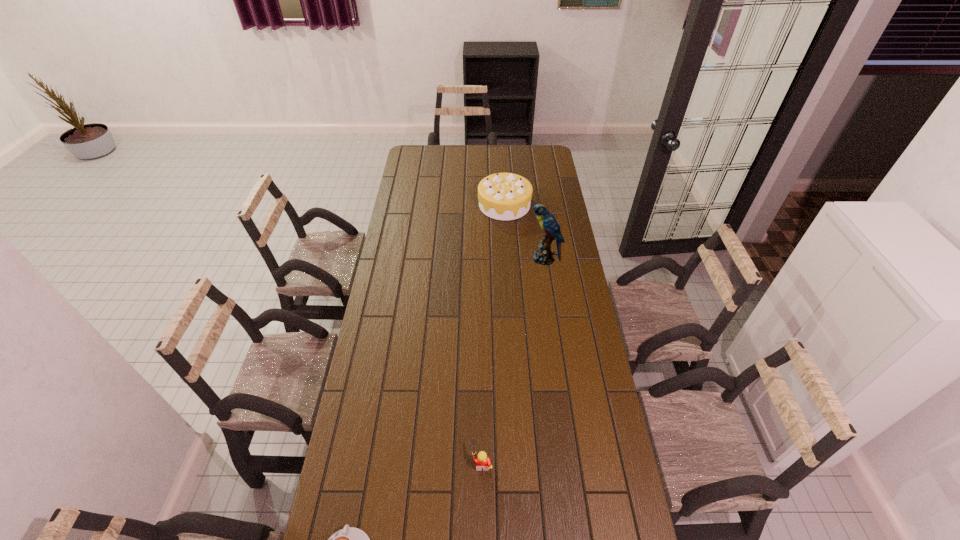
Find the location of a particular element. This screenshot has height=540, width=960. unoccupied area between the Lego and the parrot is located at coordinates (513, 360).

Locate an element on the screen. The width and height of the screenshot is (960, 540). blank region between the parrot and the farthest object is located at coordinates (524, 232).

Locate which object ranks in proximity to the parrot. Please provide its 2D coordinates. Your answer should be formatted as a tuple, i.e. [(x, y)], where the tuple contains the x and y coordinates of a point satisfying the conditions above.

[(502, 196)]

Where is `object that is the second closest one to the tallest object`? object that is the second closest one to the tallest object is located at coordinates (482, 461).